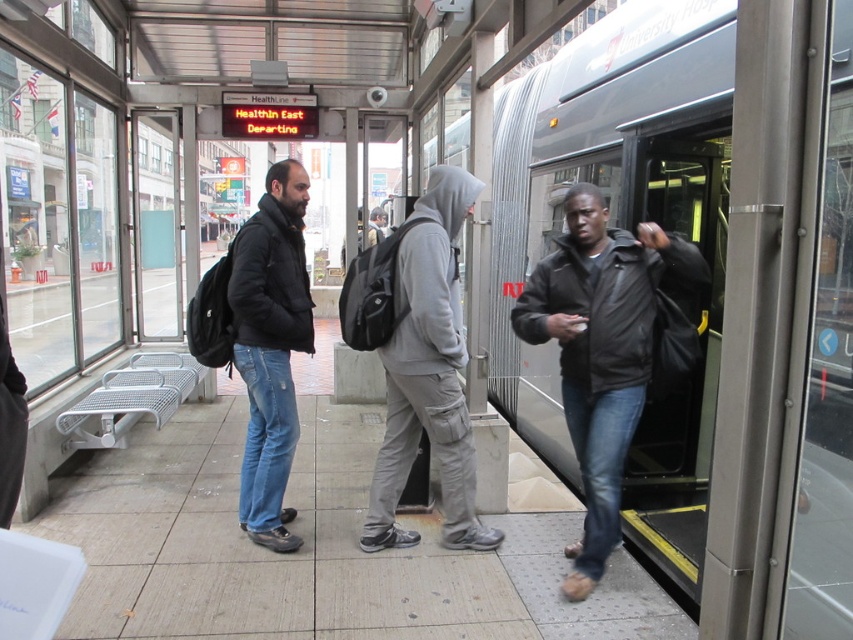
Between metallic gray train at center and matte black jacket at center, which one is positioned lower?

matte black jacket at center is below.

Is metallic gray train at center smaller than matte black jacket at center?

Yes, metallic gray train at center is smaller than matte black jacket at center.

Is point (712, 477) positioned in front of point (271, 374)?

Yes.

The height and width of the screenshot is (640, 853). What are the coordinates of `metallic gray train at center` in the screenshot? It's located at (711, 284).

Between point (631, 349) and point (260, 497), which one is positioned in front?

Point (631, 349) is in front.

Is dark brown leather jacket at right thinner than matte black jacket at center?

Incorrect, dark brown leather jacket at right's width is not less than matte black jacket at center's.

Between point (635, 403) and point (258, 541), which one is positioned in front?

Point (635, 403)

Where is `dark brown leather jacket at right`? Image resolution: width=853 pixels, height=640 pixels. dark brown leather jacket at right is located at coordinates (602, 349).

Is metallic gray train at center in front of gray hoodie at center?

No.

Who is more forward, (x=548, y=371) or (x=428, y=333)?

Point (x=428, y=333)

Is point (805, 394) positioned before point (396, 275)?

Yes.

Find the location of `metallic gray train at center`. metallic gray train at center is located at coordinates (711, 284).